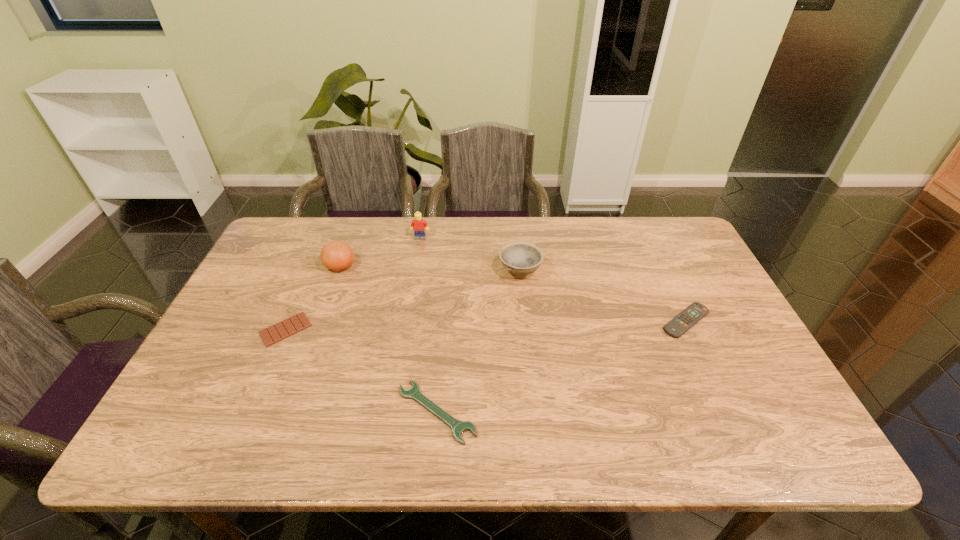
Image resolution: width=960 pixels, height=540 pixels. I want to click on vacant area located 0.050m on the front-facing side of the farthest object, so click(419, 249).

Where is `free region located 0.120m on the front of the second tallest object`? free region located 0.120m on the front of the second tallest object is located at coordinates click(x=326, y=305).

In order to click on free space located on the front of the third tallest object in this screenshot , I will do `click(533, 392)`.

The height and width of the screenshot is (540, 960). I want to click on vacant position located 0.200m on the back of the remote control, so click(658, 260).

The width and height of the screenshot is (960, 540). What are the coordinates of `vacant space situated 0.210m on the left of the nearest object` in the screenshot? It's located at tap(304, 412).

At what (x,y) coordinates should I click in order to perform the action: click on free space located on the front of the shortest object. Please return your answer as a coordinate pair (x, y). This screenshot has width=960, height=540. Looking at the image, I should click on (261, 387).

You are a GUI agent. You are given a task and a screenshot of the screen. Output one action in this format:
    pyautogui.click(x=<x>, y=<y>)
    Task: Click on the Lego that is positioned at the far edge
    The height and width of the screenshot is (540, 960).
    Given the screenshot: What is the action you would take?
    click(x=419, y=226)

I want to click on clementine that is at the far edge, so click(x=336, y=255).

Identify the location of bowl present at the far edge. Image resolution: width=960 pixels, height=540 pixels. (519, 258).

Identify the location of object that is at the near edge. This screenshot has width=960, height=540. (458, 427).